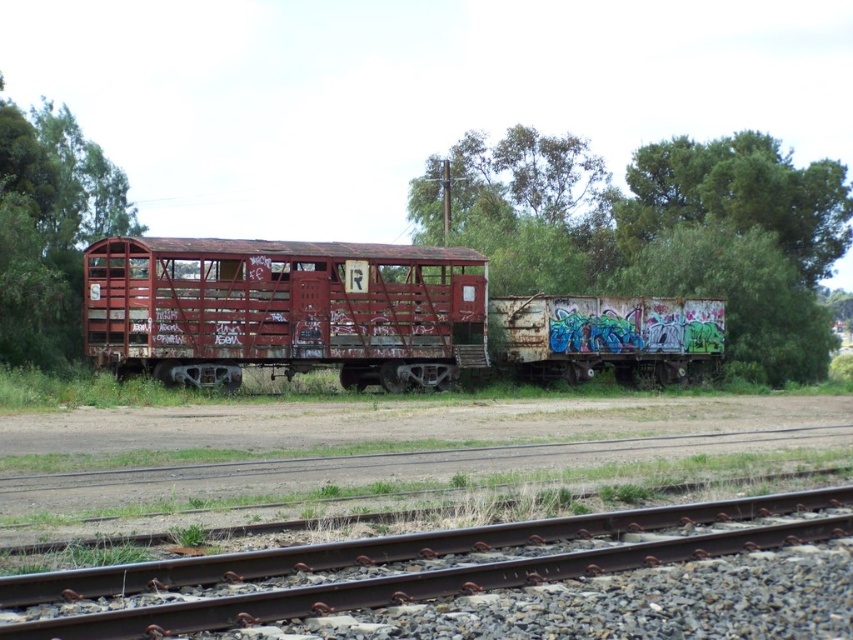
Who is shorter, rusty metal train car at center or green leafy tree at left?

Standing shorter between the two is rusty metal train car at center.

Is point (190, 282) positioned in front of point (61, 173)?

Yes, point (190, 282) is closer to viewer.

From the picture: Who is more forward, (283, 368) or (16, 321)?

Positioned in front is point (16, 321).

In order to click on rusty metal train car at center in this screenshot , I will do `click(364, 316)`.

Who is higher up, rusty metal train track at lower center or rusty metal train car at center?

rusty metal train car at center is higher up.

Is point (322, 608) less distant than point (450, 310)?

Yes, point (322, 608) is closer to viewer.

Where is `rusty metal train track at lower center`? Image resolution: width=853 pixels, height=640 pixels. rusty metal train track at lower center is located at coordinates (483, 580).

Who is lower down, rusty metal train track at lower center or green leafy tree at left?

rusty metal train track at lower center is lower down.

Who is positioned more to the left, rusty metal train track at lower center or green leafy tree at left?

green leafy tree at left is more to the left.

From the picture: Measure the distance between point (248, 592) and camera.

They are 8.54 meters apart.

Where is `rusty metal train track at lower center`? The width and height of the screenshot is (853, 640). rusty metal train track at lower center is located at coordinates (x=483, y=580).